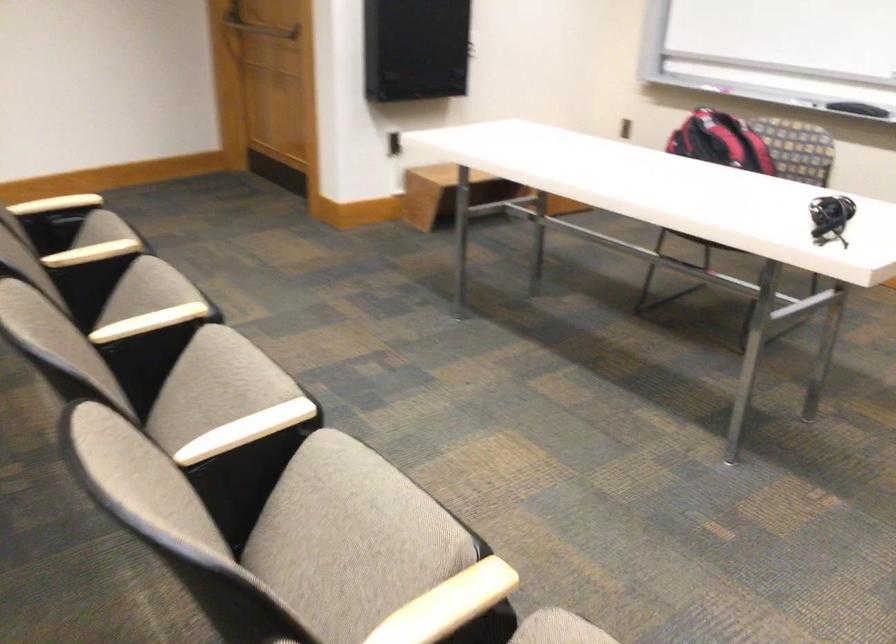
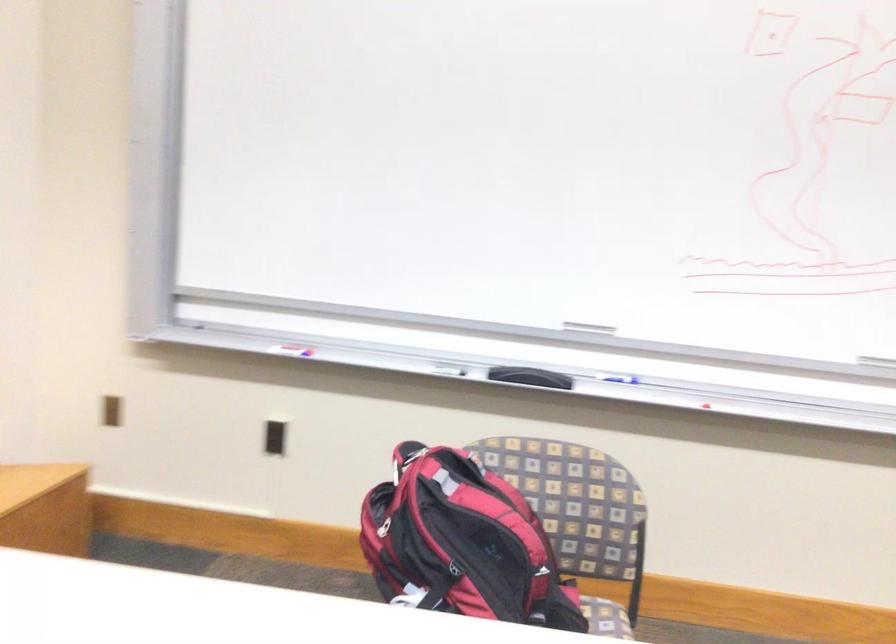
Locate, in the second image, the point that corresponds to point (728, 152) in the first image.

(478, 542)